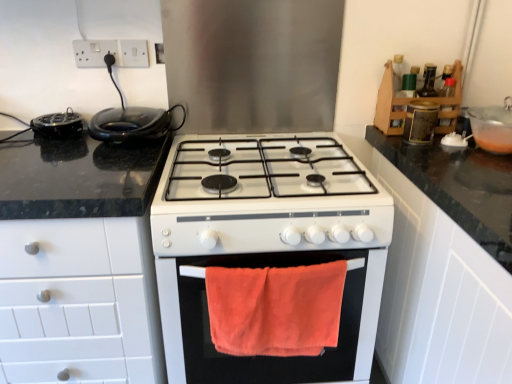
I want to click on vacant area that is in front of black glossy waffle iron at left, so click(98, 171).